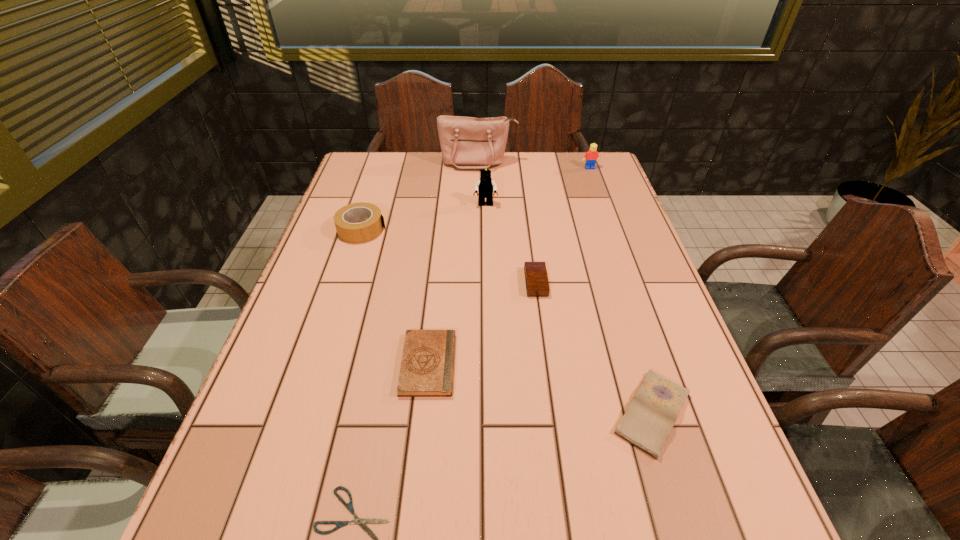
Image resolution: width=960 pixels, height=540 pixels. What are the coordinates of `vacant space that satisfies the following two spatial constraints: 1. on the front-facing side of the third farthest object; 2. at the edge of the fourth farthest object` in the screenshot? It's located at (486, 230).

Locate an element on the screen. The height and width of the screenshot is (540, 960). free spot that satisfies the following two spatial constraints: 1. at the edge of the right diary; 2. on the right side of the leftmost object is located at coordinates (302, 413).

You are a GUI agent. You are given a task and a screenshot of the screen. Output one action in this format:
    pyautogui.click(x=<x>, y=<y>)
    Task: Click on the free space that satisfies the following two spatial constraints: 1. on the face of the third tallest object; 2. on the front face of the alarm clock
    
    Given the screenshot: What is the action you would take?
    pyautogui.click(x=631, y=282)

Where is `vacant position in the image that satisfies the following two spatial constraints: 1. on the face of the shorter Lego; 2. on the front face of the alarm clock`? vacant position in the image that satisfies the following two spatial constraints: 1. on the face of the shorter Lego; 2. on the front face of the alarm clock is located at coordinates (631, 282).